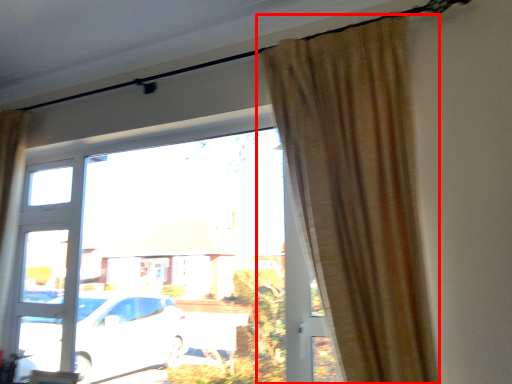
Question: From the image's perspective, where is curtain (annotated by the red box) located relative to window?

Choices:
 (A) above
 (B) below

Answer: (A)